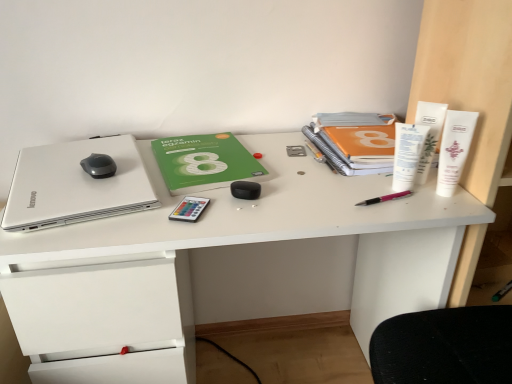
Find the location of `vacant area that lies between white matte laptop at left and white plastic tube at upper right, which is the fifth stationery in left-to-right order`. vacant area that lies between white matte laptop at left and white plastic tube at upper right, which is the fifth stationery in left-to-right order is located at coordinates (261, 190).